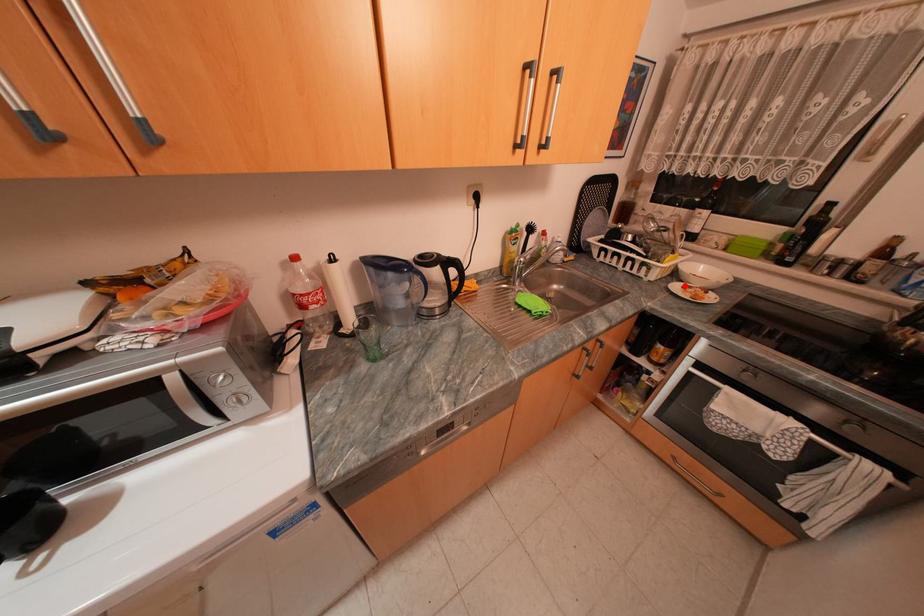
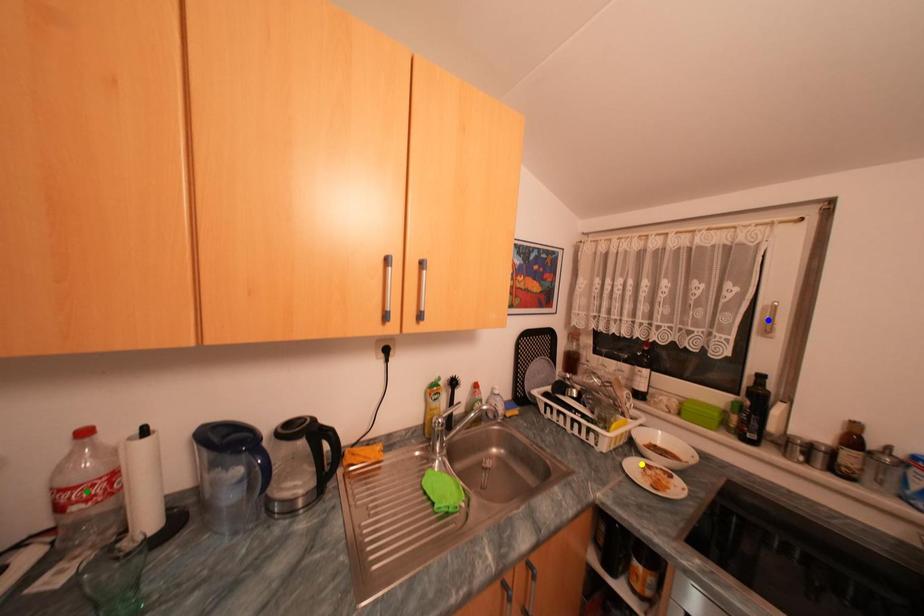
Question: I am providing you with two images of the same scene from different viewpoints. A red point is marked on the first image. You are given multiple points on the second image. Which spot in image 2 lines up with the point in image 1?

Choices:
 (A) green point
 (B) yellow point
 (C) blue point

Answer: (B)